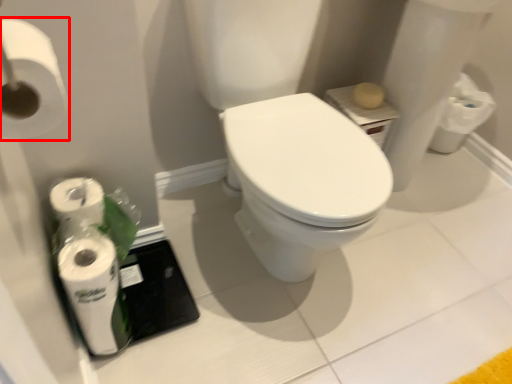
Question: From the image's perspective, what is the correct spatial positioning of toilet paper (annotated by the red box) in reference to toilet paper?

Choices:
 (A) above
 (B) below

Answer: (A)